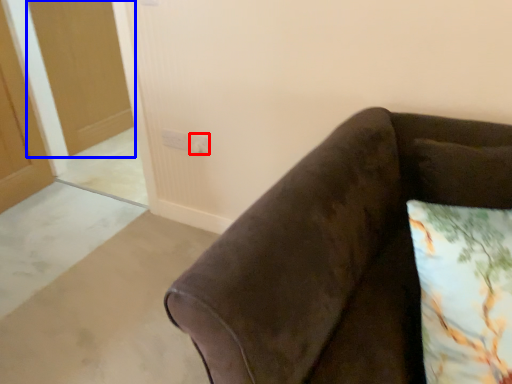
Question: Among these objects, which one is farthest to the camera, electric outlet (highlighted by a red box) or glass door (highlighted by a blue box)?

Choices:
 (A) electric outlet
 (B) glass door

Answer: (B)